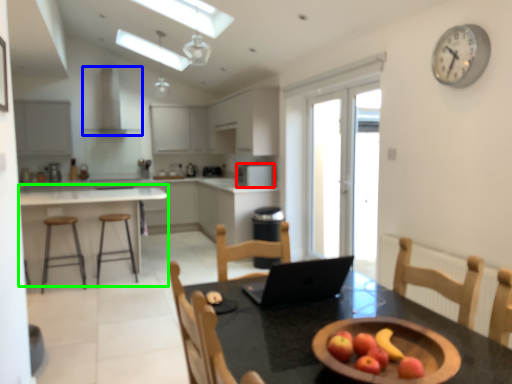
Question: Which object is positioned farthest from kitchen appliance (highlighted by a red box)? Select from exhaust hood (highlighted by a blue box) and table (highlighted by a green box).

Choices:
 (A) exhaust hood
 (B) table

Answer: (A)